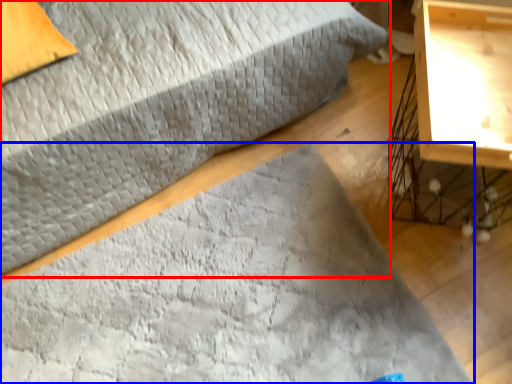
Question: Which point is further to the camera, bed (highlighted by a red box) or mat (highlighted by a blue box)?

Choices:
 (A) bed
 (B) mat

Answer: (B)